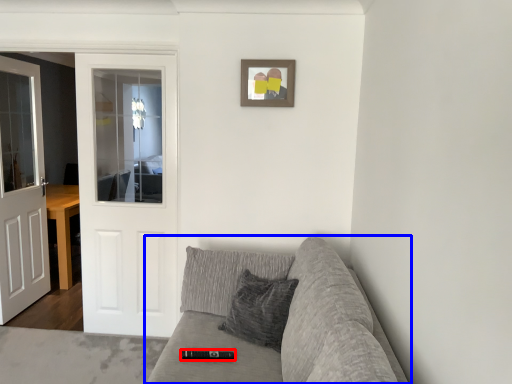
Question: Which of the following is the farthest to the observer, remote (highlighted by a red box) or studio couch (highlighted by a blue box)?

Choices:
 (A) remote
 (B) studio couch

Answer: (A)